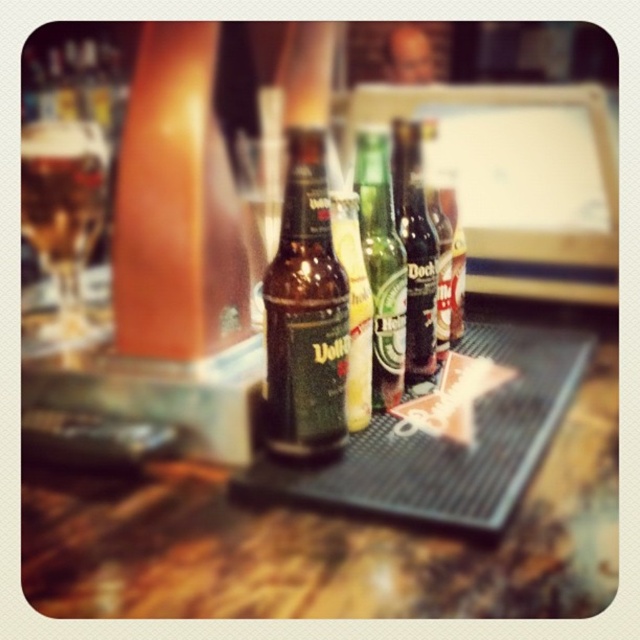
Question: Does brown glass bottle at center appear on the right side of green glass bottle at center?

Choices:
 (A) yes
 (B) no

Answer: (B)

Question: Considering the real-world distances, which object is farthest from the dark brown glass bottle at center?

Choices:
 (A) green glass bottle at center
 (B) brown glass bottle at center

Answer: (B)

Question: Which of these objects is positioned farthest from the green glass bottle at center?

Choices:
 (A) black rubber mat at center
 (B) dark brown glass bottle at center
 (C) brown glass bottle at center

Answer: (A)

Question: Considering the relative positions of brown glass bottle at center and dark brown glass bottle at center in the image provided, where is brown glass bottle at center located with respect to dark brown glass bottle at center?

Choices:
 (A) left
 (B) right

Answer: (A)

Question: Is brown glass bottle at center smaller than green glass bottle at center?

Choices:
 (A) no
 (B) yes

Answer: (A)

Question: Which point is farther from the camera taking this photo?

Choices:
 (A) (419, 236)
 (B) (305, 292)
 (C) (147, 560)

Answer: (A)